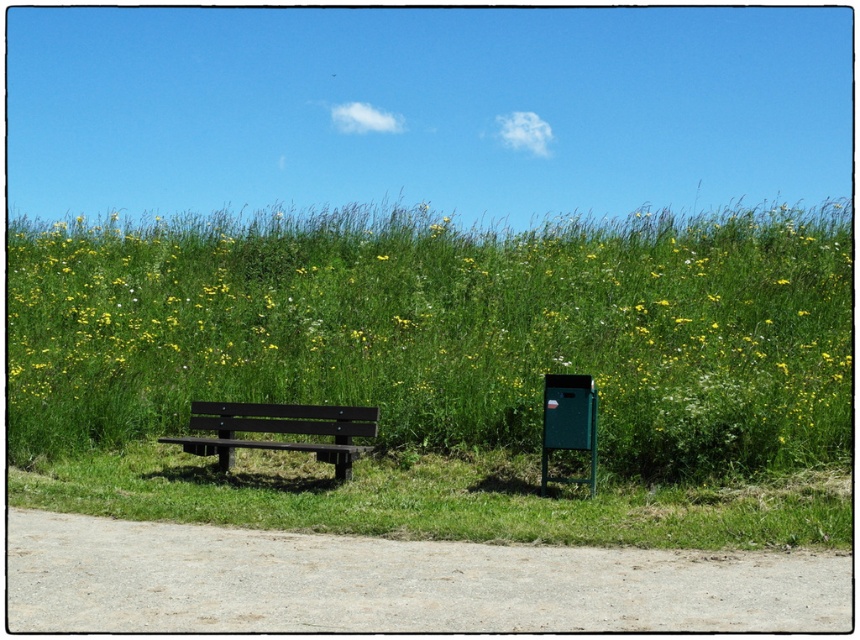
You are standing at the start of the dirt path and want to sit on the black wood bench at left. Which direction should you walk to reach it without crossing the green grass at center?

The black wood bench at left is positioned to the left of the green grass at center. Since you want to avoid walking on the green grass at center, you should walk to the left side of the path towards the black wood bench at left.

You are planning to place a small garden statue that requires a stable, flat surface. Based on the scene, which object between the green grass at center and the black wood bench at left would be more suitable for placing the statue?

The black wood bench at left is more suitable for placing the statue because it provides a stable, flat surface, whereas the green grass at center is taller and less stable.